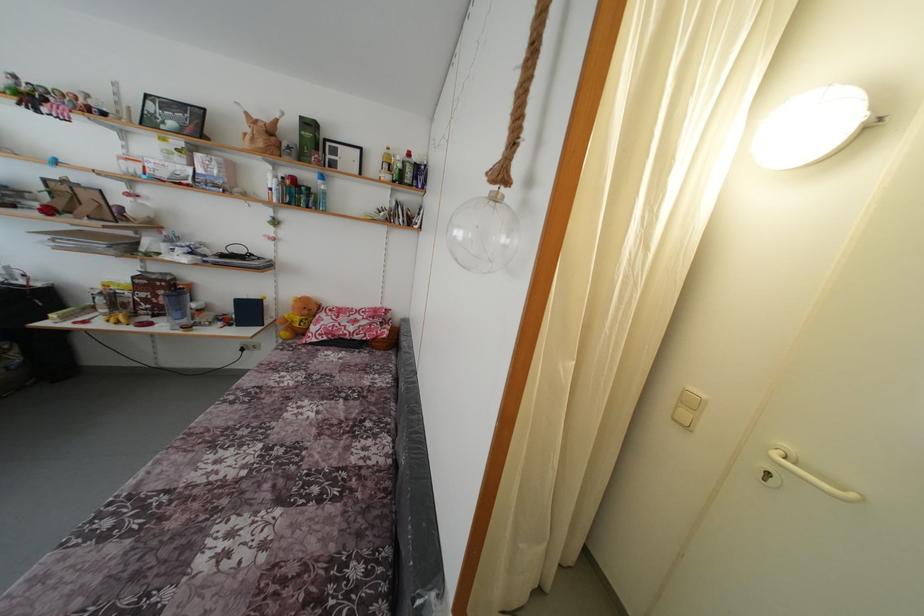
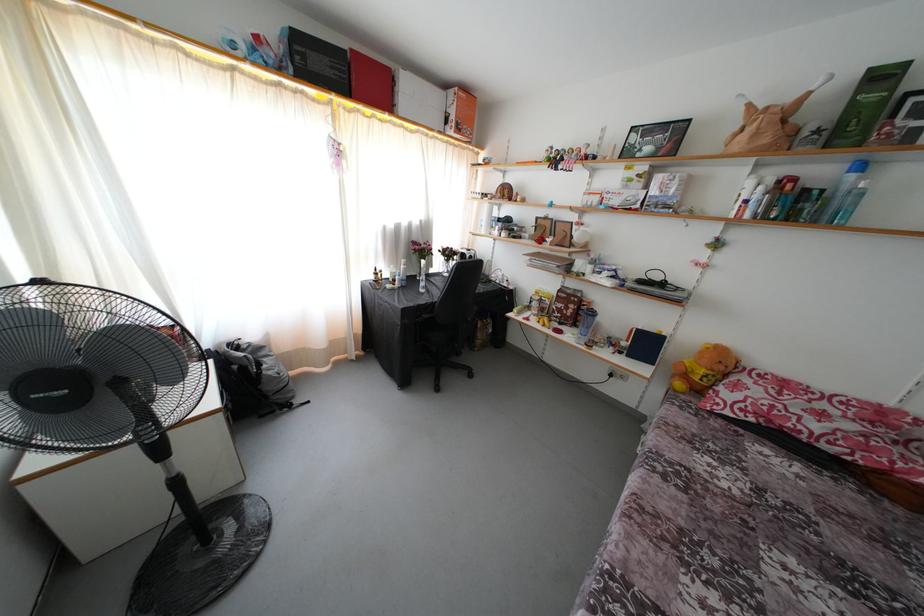
The point at (332, 321) is marked in the first image. Where is the corresponding point in the second image?

(760, 389)